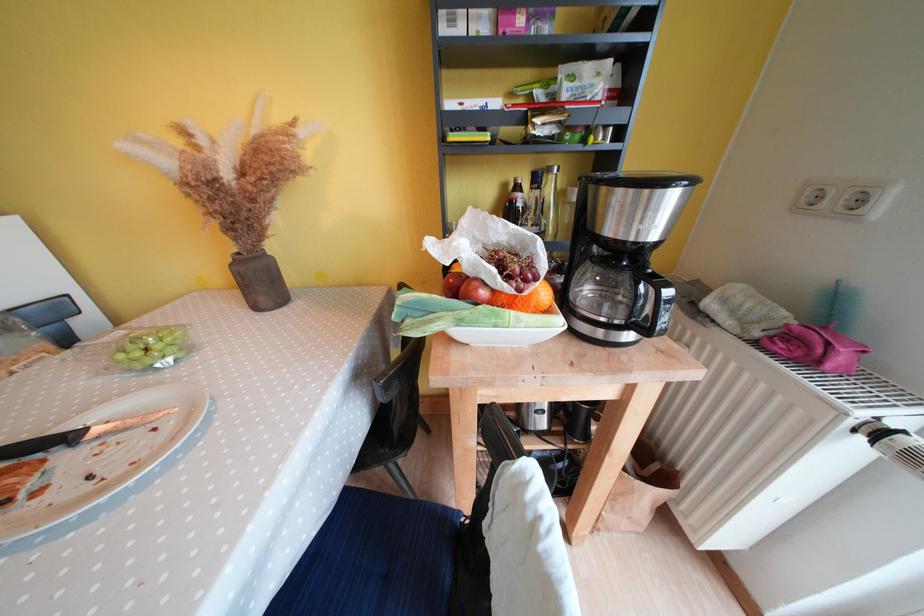
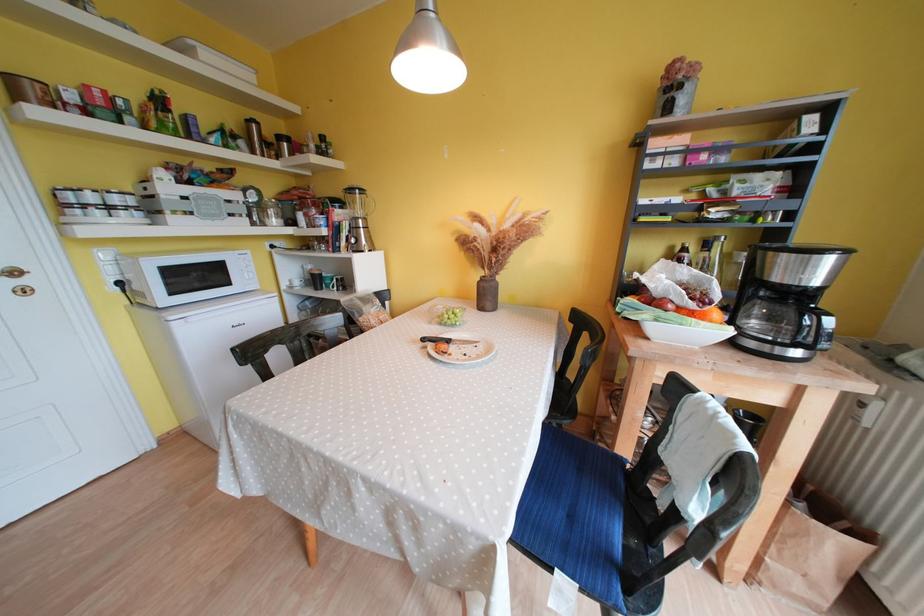
Question: The camera is either moving clockwise (left) or counter-clockwise (right) around the object. The first image is from the beginning of the video and the second image is from the end. Is the camera moving left or right when shooting the video?

Choices:
 (A) Left
 (B) Right

Answer: (B)